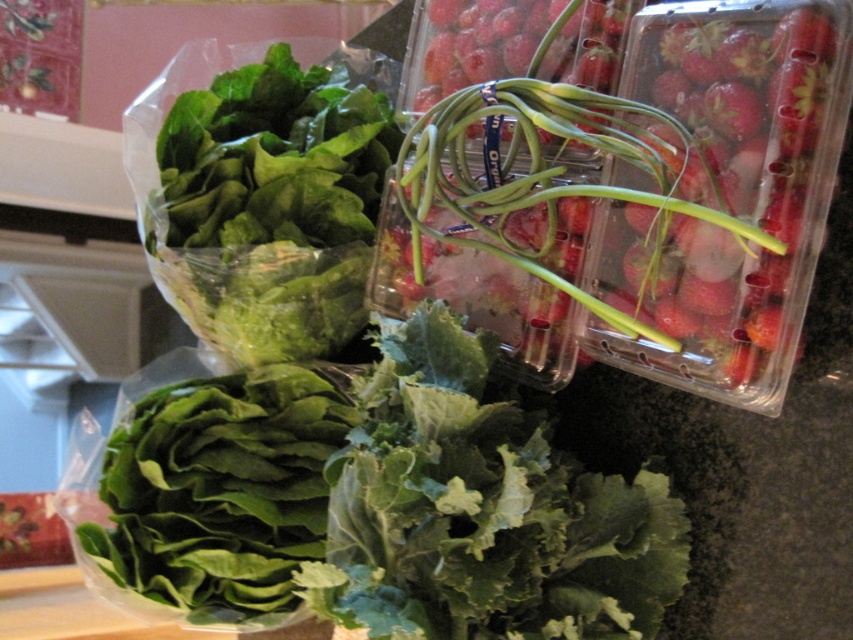
Is point (741, 307) in front of point (314, 451)?

Yes.

Between shiny red strawberries at upper right and green leafy lettuce at lower left, which one has more height?

shiny red strawberries at upper right

Between point (415, 116) and point (184, 451), which one is positioned behind?

Point (184, 451)

At what (x,y) coordinates should I click in order to perform the action: click on shiny red strawberries at upper right. Please return your answer as a coordinate pair (x, y). The height and width of the screenshot is (640, 853). Looking at the image, I should click on (724, 188).

Does shiny red strawberries at upper right appear on the right side of green leafy at center?

Indeed, shiny red strawberries at upper right is positioned on the right side of green leafy at center.

Which of these two, shiny red strawberries at upper right or green leafy at center, stands shorter?

With less height is green leafy at center.

Find the location of `shiny red strawberries at upper right`. shiny red strawberries at upper right is located at coordinates (724, 188).

Is green leafy lettuce at upper left shorter than green leafy lettuce at lower left?

In fact, green leafy lettuce at upper left may be taller than green leafy lettuce at lower left.

Does green leafy lettuce at upper left appear on the left side of green leafy lettuce at lower left?

Incorrect, green leafy lettuce at upper left is not on the left side of green leafy lettuce at lower left.

Is point (225, 291) farther from viewer compared to point (161, 435)?

No, (225, 291) is in front of (161, 435).

Where is `green leafy lettuce at upper left`? green leafy lettuce at upper left is located at coordinates (268, 208).